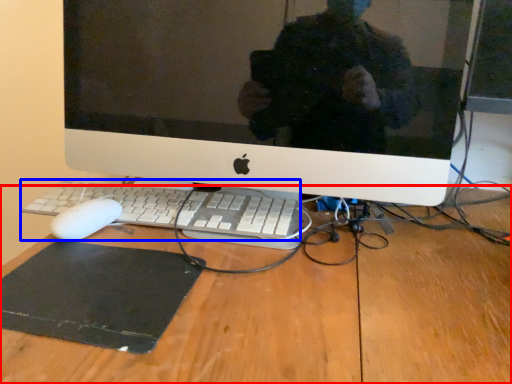
Question: Which point is further to the camera, desk (highlighted by a red box) or computer keyboard (highlighted by a blue box)?

Choices:
 (A) desk
 (B) computer keyboard

Answer: (B)